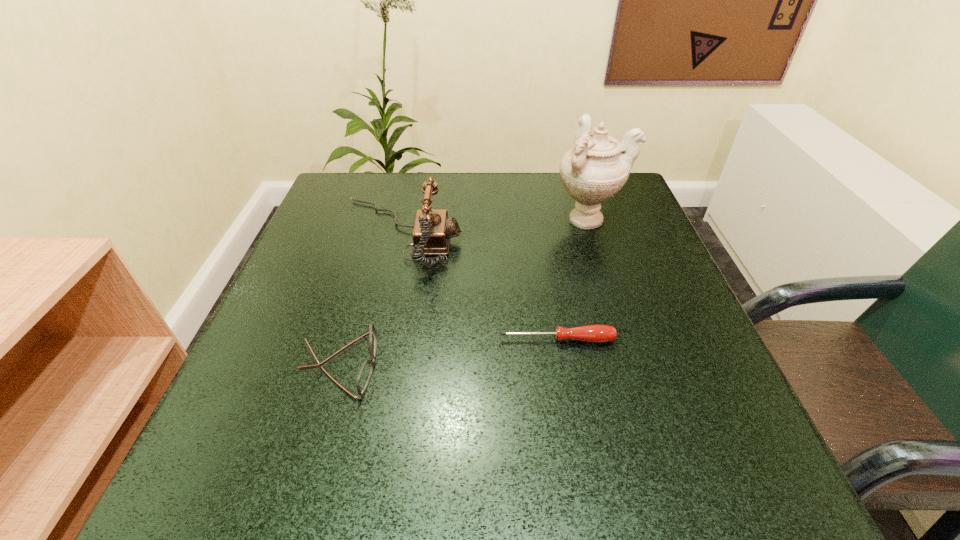
The height and width of the screenshot is (540, 960). In the image, there is a desktop. What are the coordinates of `free space at the near left corner` in the screenshot? It's located at (210, 453).

At what (x,y) coordinates should I click in order to perform the action: click on vacant area between the shortest object and the third shortest object. Please return your answer as a coordinate pair (x, y). This screenshot has width=960, height=540. Looking at the image, I should click on (478, 287).

This screenshot has width=960, height=540. I want to click on unoccupied area between the tallest object and the second tallest object, so click(x=493, y=227).

Locate an element on the screen. free point between the telephone and the urn is located at coordinates (493, 227).

At what (x,y) coordinates should I click in order to perform the action: click on free space between the second tallest object and the tallest object. Please return your answer as a coordinate pair (x, y). Image resolution: width=960 pixels, height=540 pixels. Looking at the image, I should click on (493, 227).

Identify the location of free space between the second shortest object and the telephone. Image resolution: width=960 pixels, height=540 pixels. (371, 299).

Image resolution: width=960 pixels, height=540 pixels. In order to click on free area in between the tallest object and the second shortest object in this screenshot , I will do `click(464, 292)`.

Locate an element on the screen. This screenshot has width=960, height=540. vacant area that lies between the spectacles and the telephone is located at coordinates (371, 299).

Locate an element on the screen. vacant point located between the second shortest object and the urn is located at coordinates point(464,292).

This screenshot has width=960, height=540. What are the coordinates of `vacant space that's between the urn and the shortest object` in the screenshot? It's located at (572, 280).